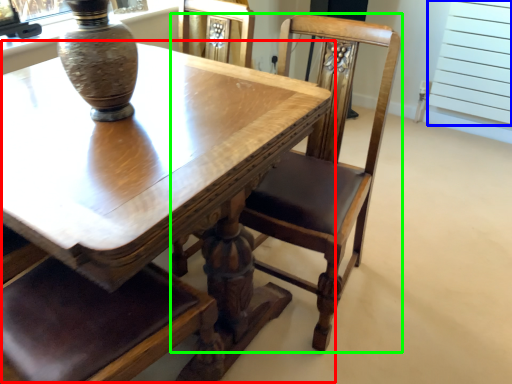
Question: Estimate the real-world distances between objects in this image. Which object is farther from table (highlighted by a red box), screen door (highlighted by a blue box) or chair (highlighted by a green box)?

Choices:
 (A) screen door
 (B) chair

Answer: (A)